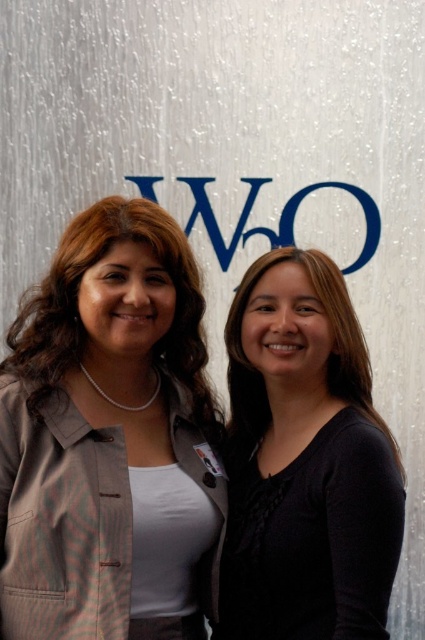
Consider the image. Who is more distant from viewer, (353, 356) or (20, 301)?

Point (20, 301)

Which is in front, point (274, 444) or point (59, 358)?

Point (59, 358) is in front.

Identify the location of black matte shirt at center. (308, 480).